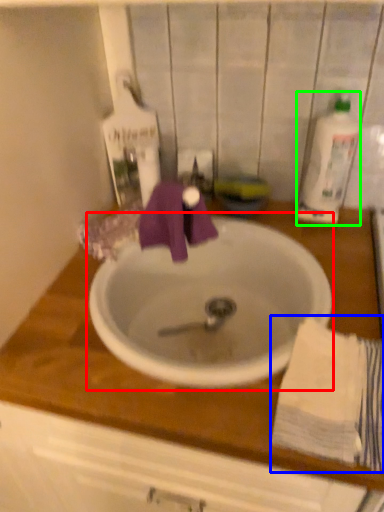
Question: Which object is positioned closest to sink (highlighted by a red box)? Select from bath towel (highlighted by a blue box) and cleaning product (highlighted by a green box).

Choices:
 (A) bath towel
 (B) cleaning product

Answer: (A)